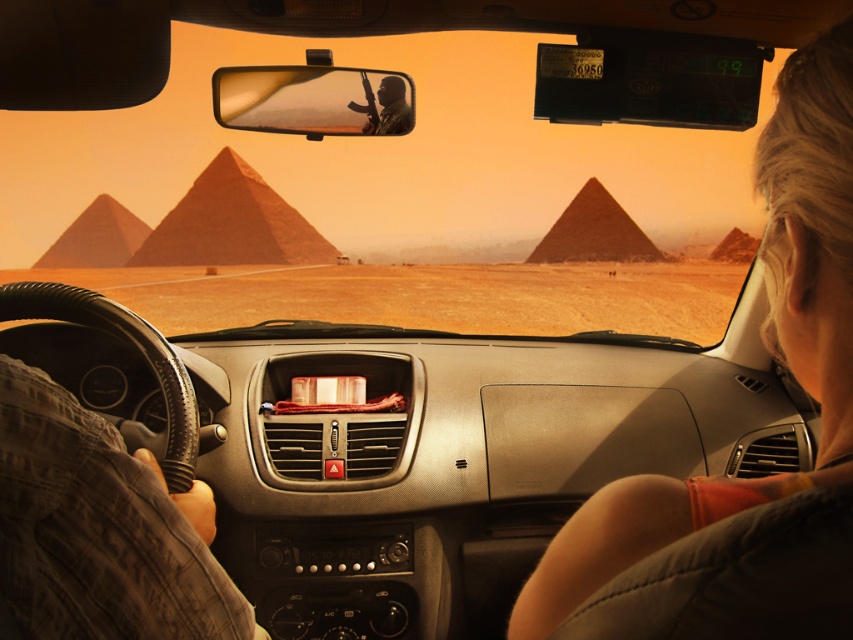
Question: Which of the following is the farthest from the observer?

Choices:
 (A) (364, 90)
 (B) (577, 230)
 (C) (264, 212)
 (D) (534, 612)

Answer: (B)

Question: Is brown textured shirt at lower left closer to camera compared to matte black rifle at upper center?

Choices:
 (A) no
 (B) yes

Answer: (B)

Question: Which of the following is the farthest from the observer?

Choices:
 (A) brown textured shirt at lower left
 (B) matte black rifle at upper center
 (C) smooth sandstone pyramid at center

Answer: (C)

Question: Does desert sand at center have a smaller size compared to matte black rifle at upper center?

Choices:
 (A) no
 (B) yes

Answer: (A)

Question: In this image, where is reddish sandstone pyramid at center located relative to smooth sandstone pyramid at center?

Choices:
 (A) above
 (B) below

Answer: (A)

Question: Which point appears farthest from the camera in this image?

Choices:
 (A) (225, 211)
 (B) (358, 108)
 (C) (402, 326)

Answer: (A)